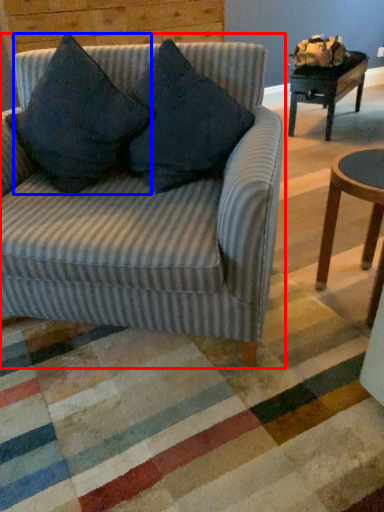
Question: Which of the following is the closest to the observer, studio couch (highlighted by a red box) or throw pillow (highlighted by a blue box)?

Choices:
 (A) studio couch
 (B) throw pillow

Answer: (A)